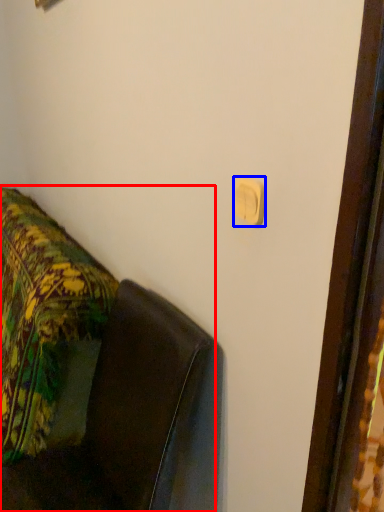
Question: Which object is further to the camera taking this photo, furniture (highlighted by a red box) or light switch (highlighted by a blue box)?

Choices:
 (A) furniture
 (B) light switch

Answer: (B)